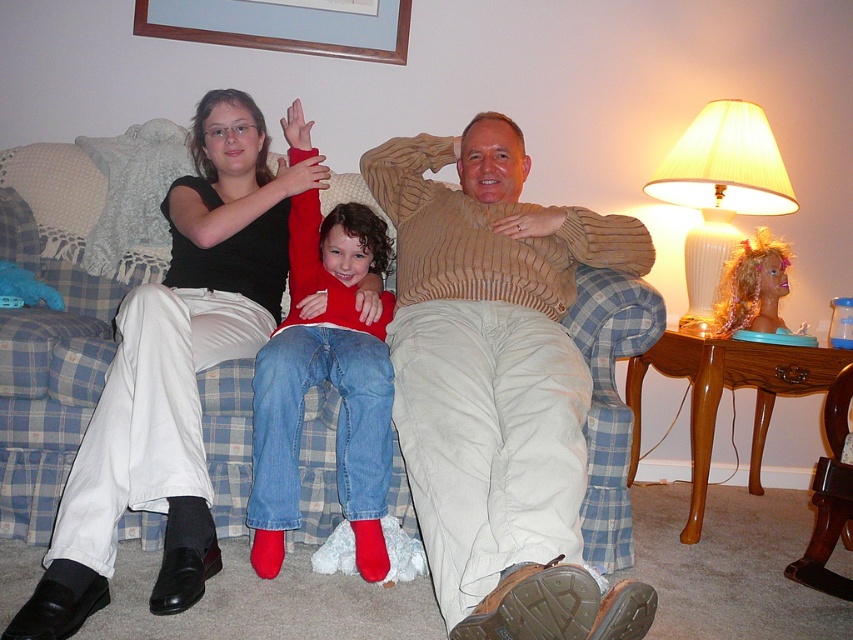
Question: Is matte black shirt at upper left wider than white porcelain lampshade at upper right?

Choices:
 (A) no
 (B) yes

Answer: (A)

Question: Considering the real-world distances, which object is farthest from the white porcelain lampshade at upper right?

Choices:
 (A) matte black shoes at lower left
 (B) matte black shirt at upper left

Answer: (B)

Question: Does wooden picture frame at upper center appear on the right side of wooden chair at lower right?

Choices:
 (A) yes
 (B) no

Answer: (B)

Question: Can you confirm if matte black shoes at lower left is bigger than matte black shirt at upper left?

Choices:
 (A) yes
 (B) no

Answer: (A)

Question: Among these objects, which one is farthest from the camera?

Choices:
 (A) wooden picture frame at upper center
 (B) matte black shirt at upper left
 (C) red velvet socks at center

Answer: (A)

Question: Which point is farther to the camera?

Choices:
 (A) matte black shoes at lower left
 (B) wooden chair at lower right
 (C) white porcelain lampshade at upper right
 (D) red velvet socks at center

Answer: (C)